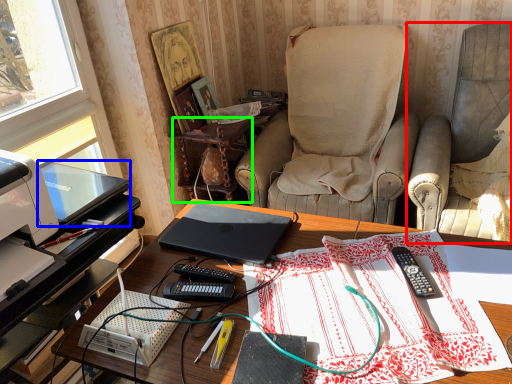
Question: Considering the real-world distances, which object is farthest from chair (highlighted by a red box)? laptop (highlighted by a blue box) or side table (highlighted by a green box)?

Choices:
 (A) laptop
 (B) side table

Answer: (A)